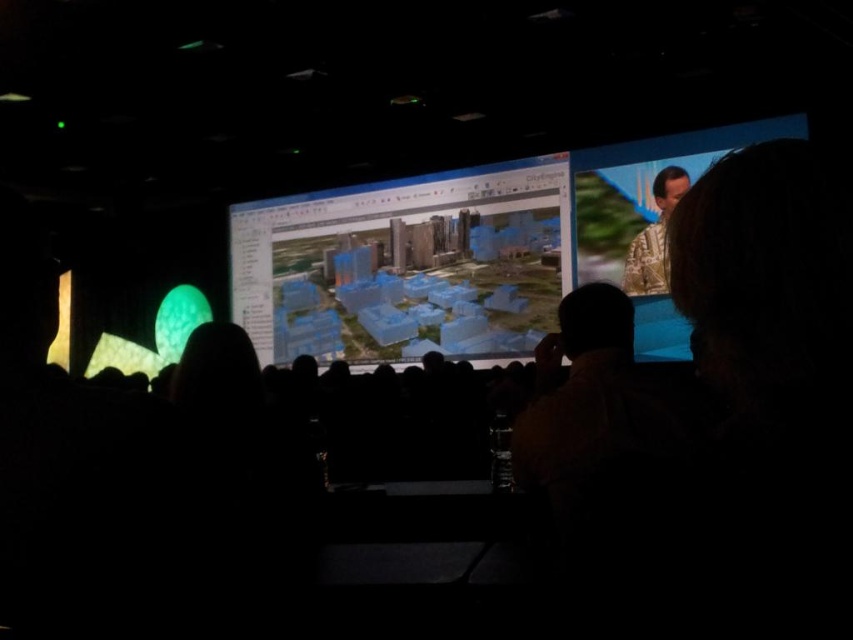
Question: Does transparent blue model at center appear on the right side of camouflage fabric speaker at upper right?

Choices:
 (A) yes
 (B) no

Answer: (B)

Question: In this image, where is camouflage fabric speaker at upper right located relative to patterned fabric shirt at upper right?

Choices:
 (A) above
 (B) below

Answer: (A)

Question: Which object is closer to the camera taking this photo?

Choices:
 (A) transparent blue model at center
 (B) patterned fabric shirt at upper right

Answer: (B)

Question: Is camouflage fabric speaker at upper right bigger than patterned fabric shirt at upper right?

Choices:
 (A) yes
 (B) no

Answer: (A)

Question: Which point is closer to the camera?

Choices:
 (A) camouflage fabric speaker at upper right
 (B) patterned fabric shirt at upper right
 (C) transparent blue model at center

Answer: (A)

Question: Which point is closer to the camera?

Choices:
 (A) patterned fabric shirt at upper right
 (B) camouflage fabric speaker at upper right

Answer: (B)